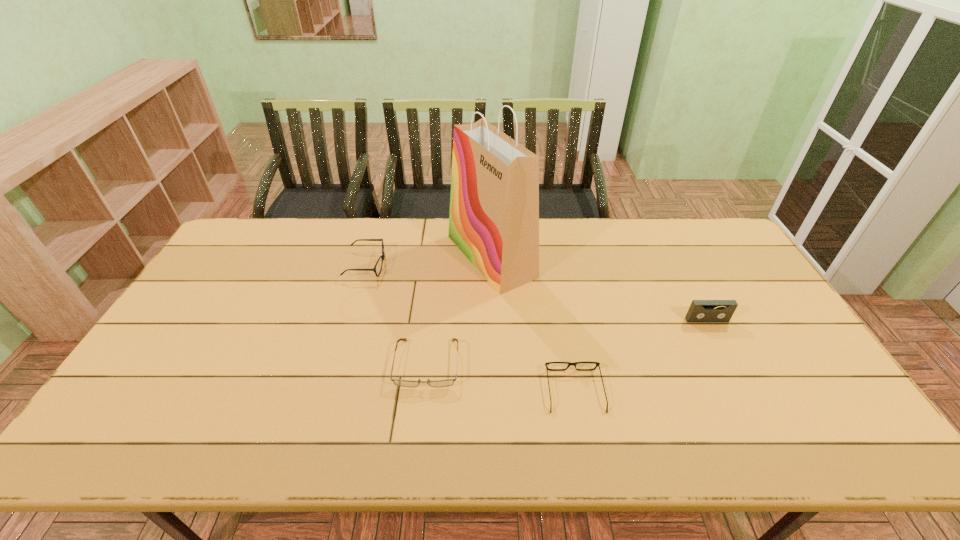
Where is `vacant region located on the front-facing side of the rightmost spectacles`? Image resolution: width=960 pixels, height=540 pixels. vacant region located on the front-facing side of the rightmost spectacles is located at coordinates (556, 291).

Where is `vacant area situated on the front-facing side of the rightmost spectacles`? This screenshot has width=960, height=540. vacant area situated on the front-facing side of the rightmost spectacles is located at coordinates (564, 335).

Locate an element on the screen. Image resolution: width=960 pixels, height=540 pixels. blank space located on the front-facing side of the rightmost spectacles is located at coordinates (553, 272).

Find the location of a particular element. shopping bag that is positioned at the far edge is located at coordinates (494, 204).

Where is `spectacles situated at the far edge`? The image size is (960, 540). spectacles situated at the far edge is located at coordinates (382, 256).

Where is `vacant space at the far edge of the desktop`? vacant space at the far edge of the desktop is located at coordinates [284, 243].

In the image, there is a desktop. Find the location of `free space at the near edge`. free space at the near edge is located at coordinates (190, 455).

Locate an element on the screen. The width and height of the screenshot is (960, 540). vacant area at the left edge of the desktop is located at coordinates (235, 287).

Find the location of a particular element. vacant space at the right edge of the desktop is located at coordinates (739, 334).

This screenshot has height=540, width=960. I want to click on free space between the rightmost spectacles and the leftmost spectacles, so click(470, 328).